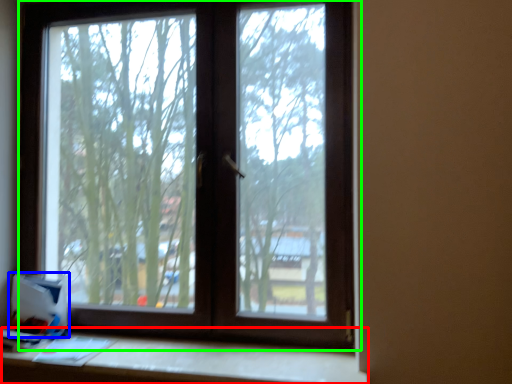
Question: Which object is the closest to the table (highlighted by a red box)? Choose among these: cardboard box (highlighted by a blue box) or window (highlighted by a green box).

Choices:
 (A) cardboard box
 (B) window

Answer: (A)